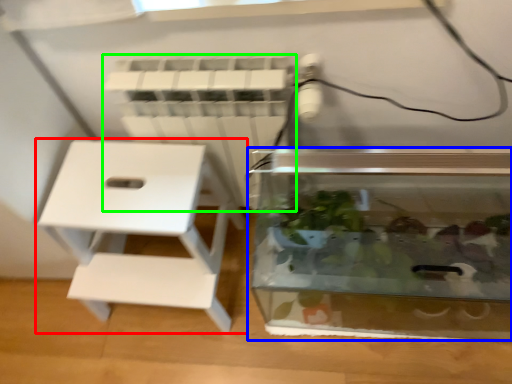
Question: Which is farther away from furniture (highlighted by a red box)? glass box (highlighted by a blue box) or radiator (highlighted by a green box)?

Choices:
 (A) glass box
 (B) radiator

Answer: (A)